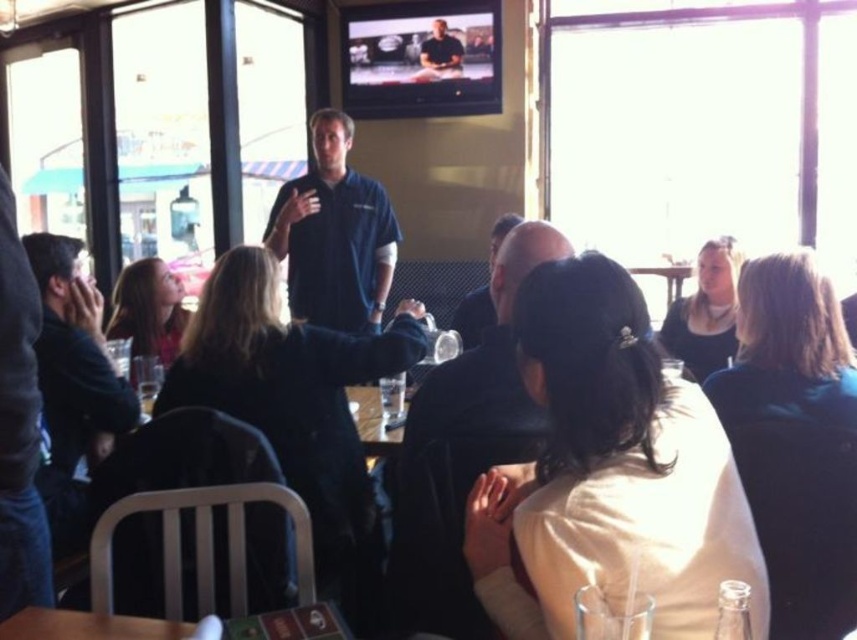
You are a photographer trying to capture a photo of the black matte shirt at center and the wooden table at center. Based on their heights, which object should you focus on first if you want to ensure both are in frame without moving the camera?

The black matte shirt at center is taller than the wooden table at center, so you should focus on the black matte shirt at center first to ensure both are in frame.